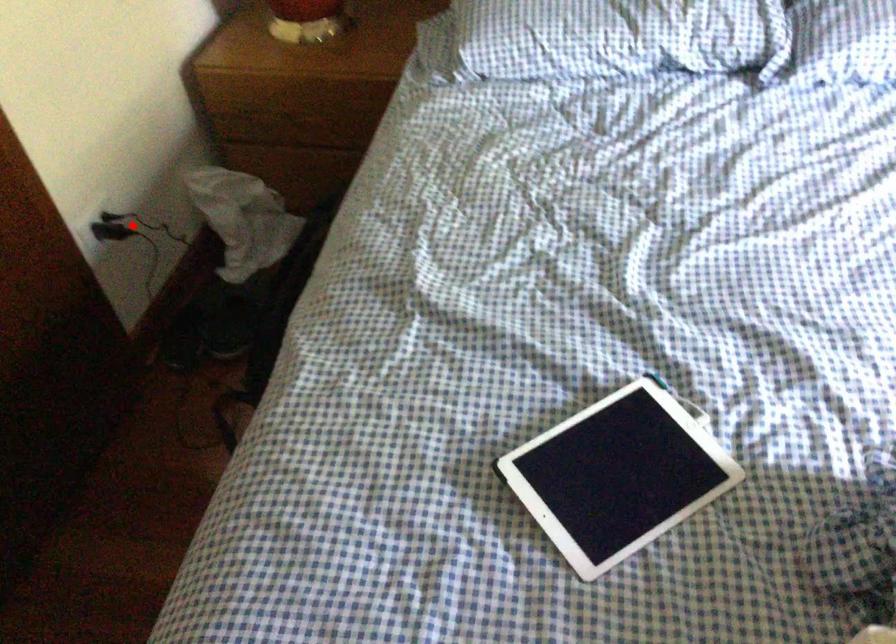
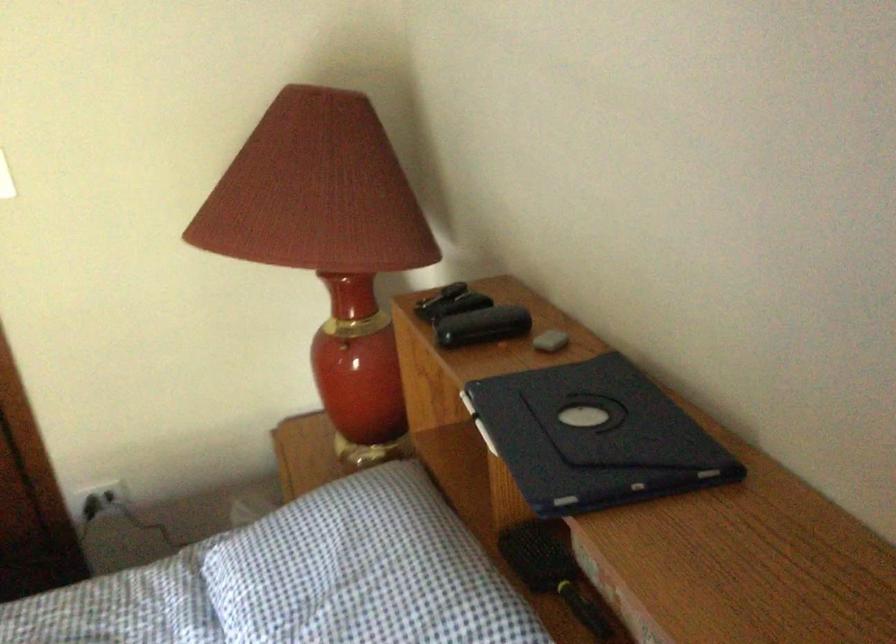
Question: I am providing you with two images of the same scene from different viewpoints. A red point is marked on the first image. Is the red point's position out of view in image 2?

Choices:
 (A) Yes
 (B) No

Answer: (B)